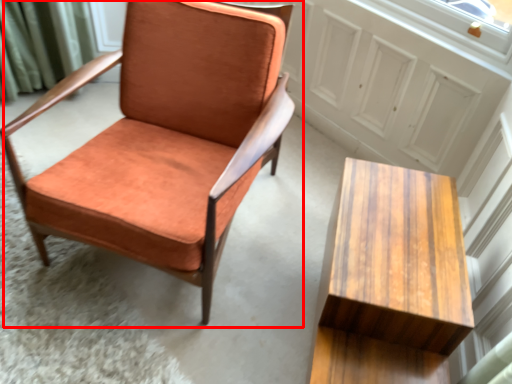
Question: From the image, what is the correct spatial relationship of chair (annotated by the red box) in relation to table?

Choices:
 (A) left
 (B) right

Answer: (A)